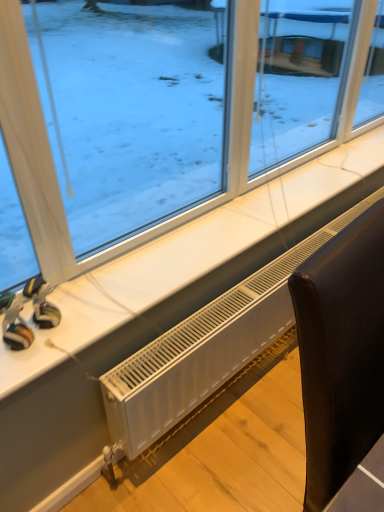
Locate an element on the screen. unoccupied space behind rubberized plastic toy at lower left, which is counted as the 1th toy, starting from the left is located at coordinates (76, 294).